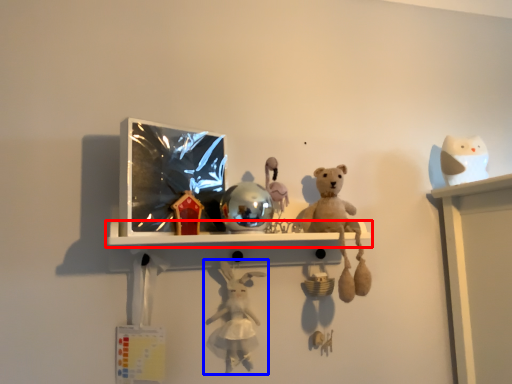
Question: Which object appears closest to the camera in this image, shelf (highlighted by a red box) or toy (highlighted by a blue box)?

Choices:
 (A) shelf
 (B) toy

Answer: (A)